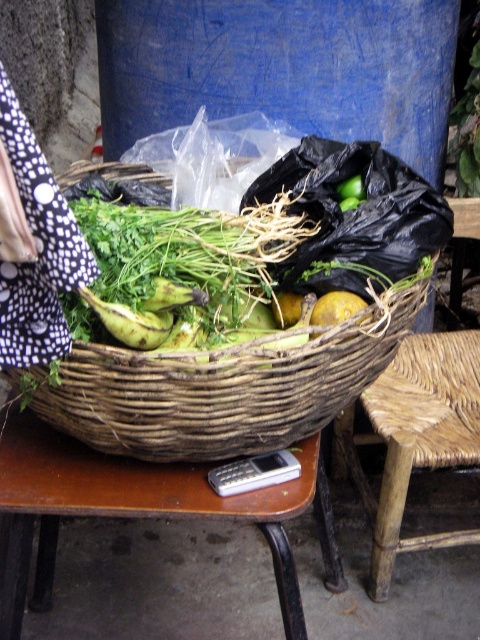
Question: Which of the following is the farthest from the observer?

Choices:
 (A) (460, 275)
 (B) (63, 408)

Answer: (A)

Question: Which object is positioned farthest from the woven brown basket at center?

Choices:
 (A) woven wood chair at lower right
 (B) brown wooden table at lower center

Answer: (A)

Question: Is woven brown basket at center behind brown wooden table at lower center?

Choices:
 (A) yes
 (B) no

Answer: (B)

Question: Does woven brown basket at center have a smaller size compared to yellow matte potato at center?

Choices:
 (A) no
 (B) yes

Answer: (A)

Question: Which object is positioned farthest from the woven wood chair at lower right?

Choices:
 (A) brown wooden table at lower center
 (B) yellow matte potato at center

Answer: (B)

Question: Does woven brown basket at center appear on the left side of woven wood chair at lower right?

Choices:
 (A) no
 (B) yes

Answer: (B)